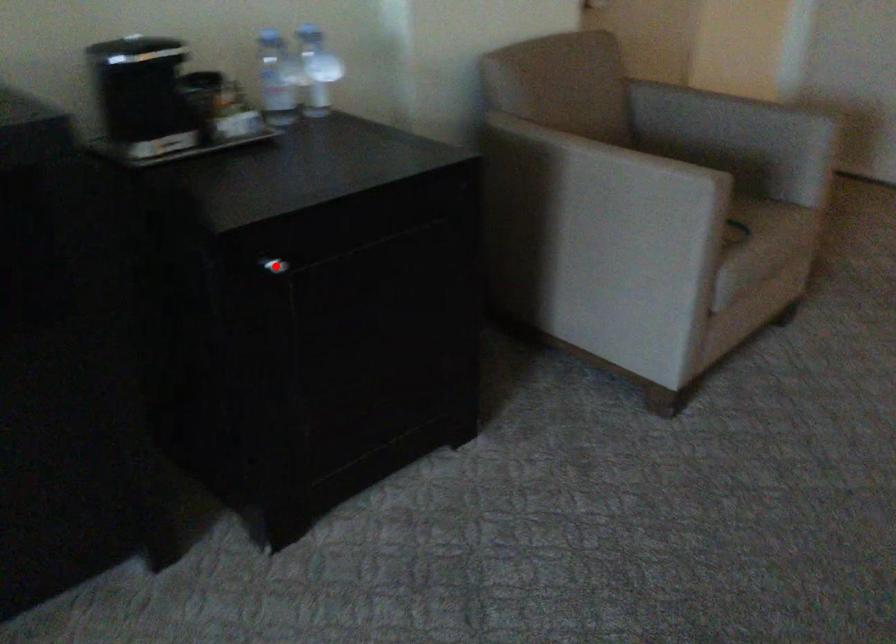
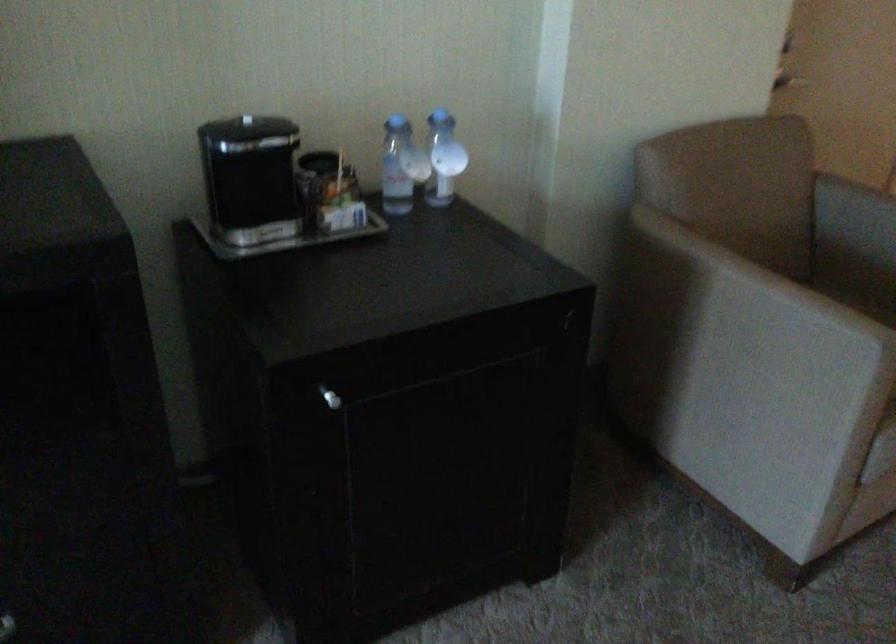
Find the pixel in the second image that matches the highlighted location in the first image.

(330, 398)